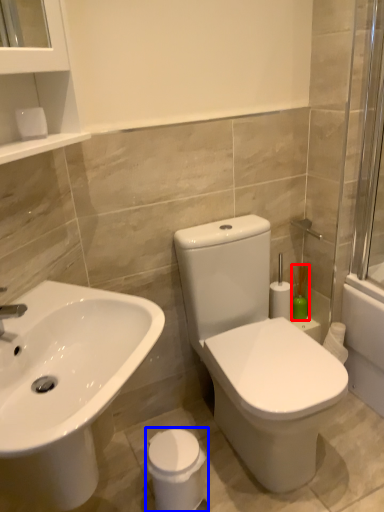
Question: Among these objects, which one is nearest to the camera, soap dispenser (highlighted by a red box) or porcelain (highlighted by a blue box)?

Choices:
 (A) soap dispenser
 (B) porcelain

Answer: (B)